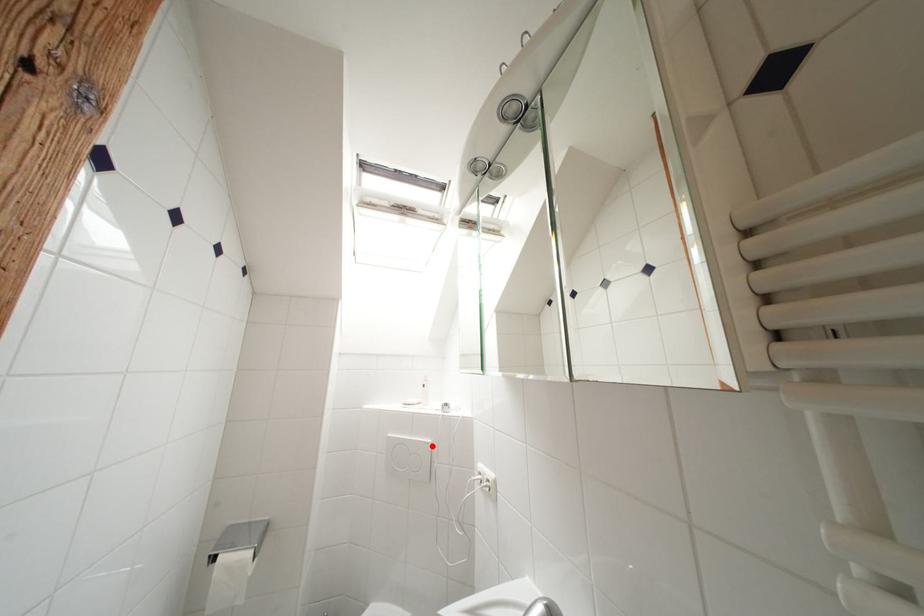
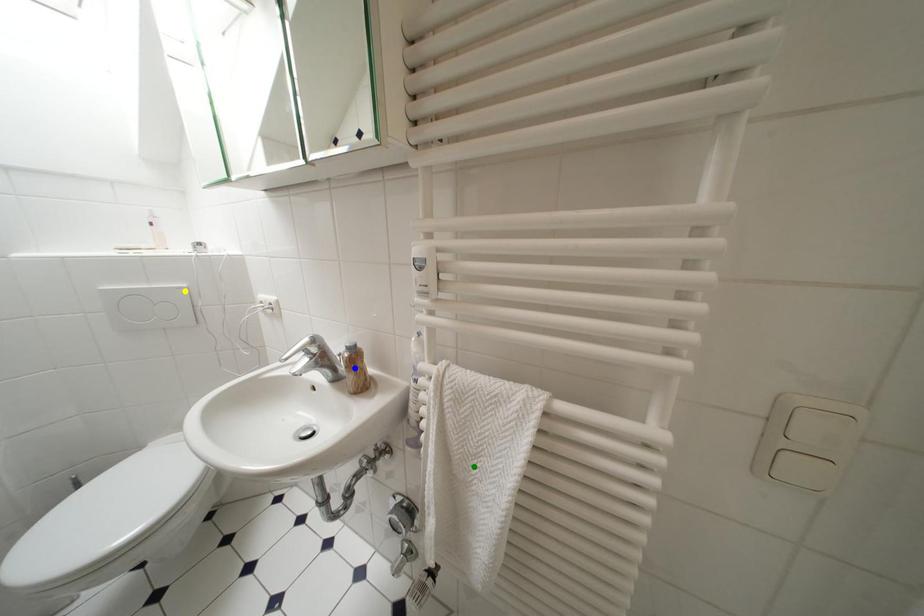
Question: I am providing you with two images of the same scene from different viewpoints. A red point is marked on the first image. You are given multiple points on the second image. Can you choose the point in image 2 that corresponds to the point in image 1?

Choices:
 (A) yellow point
 (B) blue point
 (C) green point

Answer: (A)